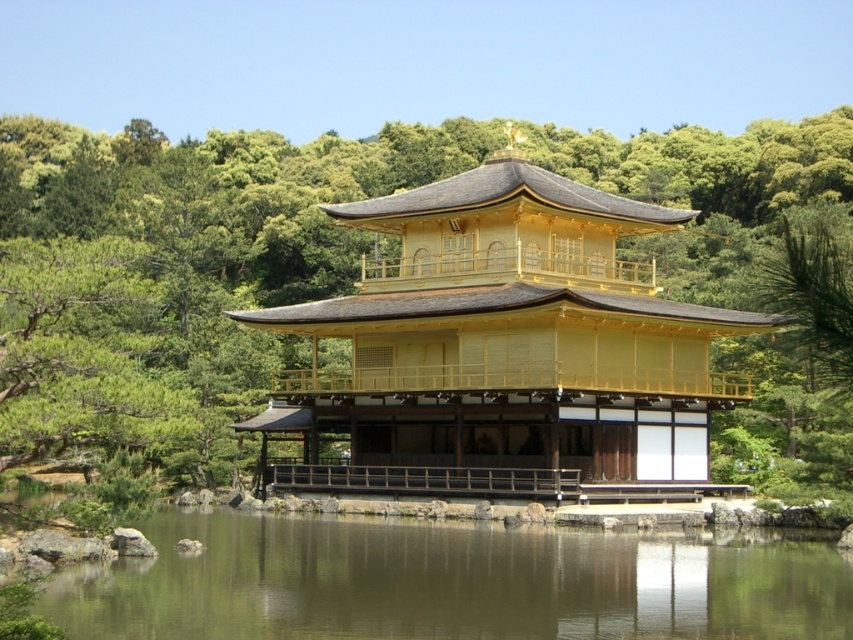
Is gold polished wood gazebo at center thinner than green reflective water at lower center?

Yes.

Is point (593, 269) closer to viewer compared to point (788, 632)?

No, (593, 269) is further to viewer.

Image resolution: width=853 pixels, height=640 pixels. I want to click on gold polished wood gazebo at center, so click(x=503, y=346).